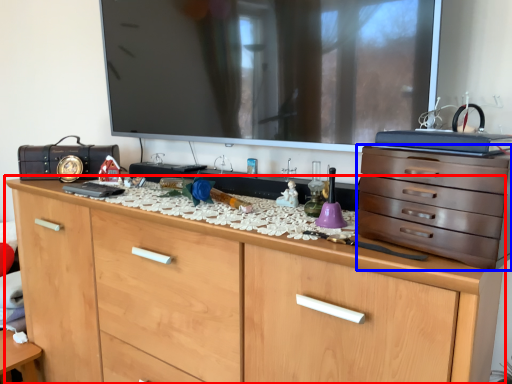
Question: Which object is further to the camera taking this photo, chest of drawers (highlighted by a red box) or chest of drawers (highlighted by a blue box)?

Choices:
 (A) chest of drawers
 (B) chest of drawers

Answer: (B)